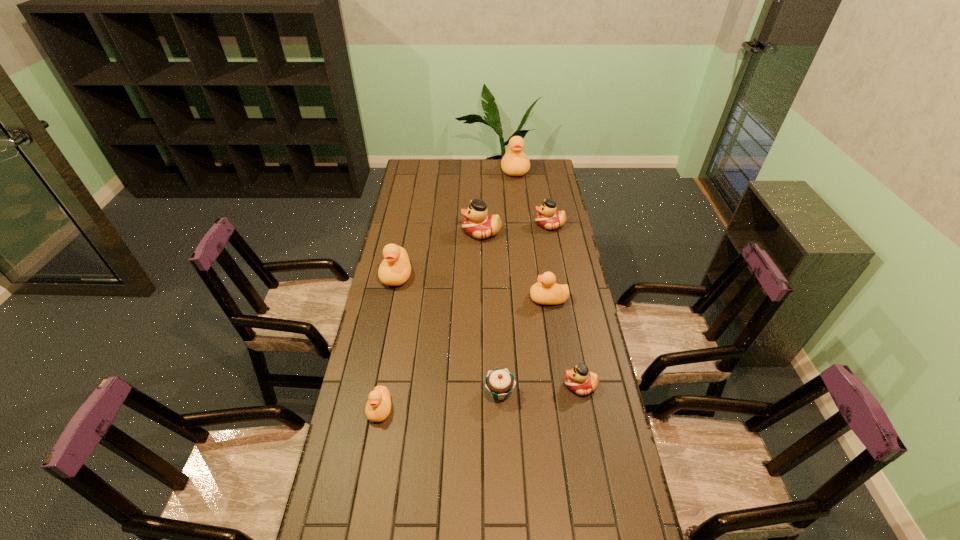
The image size is (960, 540). I want to click on the biggest yellow duck, so click(515, 162).

Locate an element on the screen. The width and height of the screenshot is (960, 540). the farthest duck is located at coordinates (515, 162).

Where is `the leftmost red duck`? the leftmost red duck is located at coordinates (478, 224).

Locate an element on the screen. This screenshot has width=960, height=540. the fifth duck from right to left is located at coordinates (478, 224).

Locate an element on the screen. This screenshot has height=540, width=960. the second biggest yellow duck is located at coordinates (395, 269).

The height and width of the screenshot is (540, 960). I want to click on the second biggest red duck, so click(547, 217).

Locate an element on the screen. The image size is (960, 540). the third biggest yellow duck is located at coordinates (546, 292).

Find the location of a particular element. The width and height of the screenshot is (960, 540). the smallest red duck is located at coordinates (579, 379).

Locate an element on the screen. teal cupcake is located at coordinates (500, 383).

You are a GUI agent. You are given a task and a screenshot of the screen. Output one action in this format:
    pyautogui.click(x=<x>, y=<y>)
    Task: Click on the smallest yellow duck
    
    Given the screenshot: What is the action you would take?
    pyautogui.click(x=378, y=407)